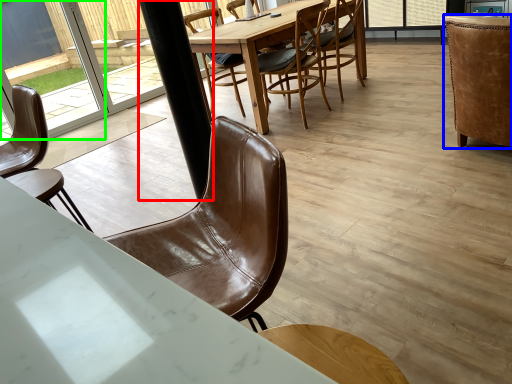
Question: Estimate the real-world distances between objects in this image. Which object is closer to pole (highlighted by a red box), chair (highlighted by a blue box) or glass door (highlighted by a green box)?

Choices:
 (A) chair
 (B) glass door

Answer: (A)